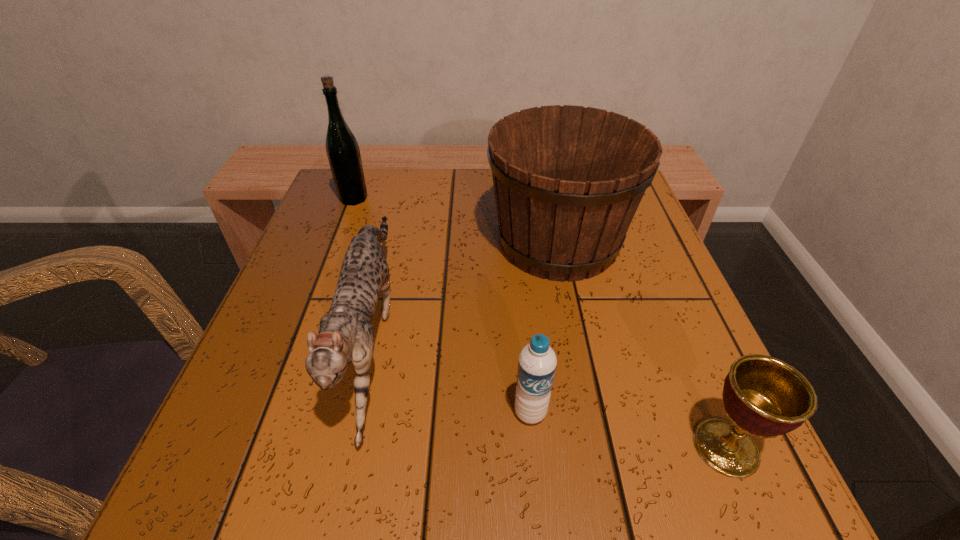
This screenshot has height=540, width=960. What are the coordinates of `beer bottle` in the screenshot? It's located at (342, 148).

Identify the location of the leftmost object. Image resolution: width=960 pixels, height=540 pixels. (342, 148).

What are the coordinates of `wine bucket` in the screenshot? It's located at (568, 180).

I want to click on cat, so click(345, 334).

Locate an element on the screen. water bottle is located at coordinates (537, 362).

The image size is (960, 540). Find the location of `chalice`. chalice is located at coordinates (764, 397).

You are a GUI agent. You are given a task and a screenshot of the screen. Output one action in this format:
    pyautogui.click(x=<x>, y=<y>)
    Task: Click on the free region located on the front of the tallest object
    This screenshot has width=960, height=540.
    Given the screenshot: What is the action you would take?
    pyautogui.click(x=324, y=276)

This screenshot has width=960, height=540. Identify the location of free region located on the left of the second tallest object. (448, 242).

I want to click on free space located 0.070m on the label of the water bottle, so click(537, 478).

Identify the location of free space located on the left of the chalice. (481, 447).